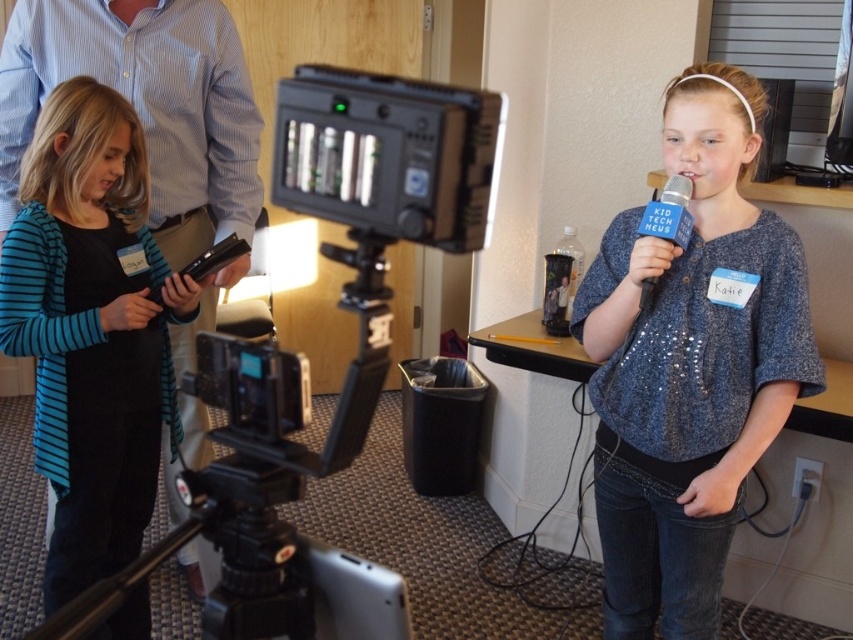
Question: Which of the following is the farthest from the observer?

Choices:
 (A) (358, 397)
 (B) (35, 168)
 (C) (677, 428)

Answer: (B)

Question: Which of the following is the farthest from the observer?

Choices:
 (A) (640, 308)
 (B) (392, 576)
 (C) (65, 278)

Answer: (C)

Question: From the image, what is the correct spatial relationship of blue striped cardigan at left in relation to blue fabric microphone at center?

Choices:
 (A) above
 (B) below

Answer: (B)

Question: Which object is closer to the camera taking this photo?

Choices:
 (A) sparkly blue blouse at center
 (B) blue striped cardigan at left
 (C) blue fabric microphone at center

Answer: (C)

Question: Does black plastic video camera at center appear under blue fabric microphone at center?

Choices:
 (A) yes
 (B) no

Answer: (A)

Question: Does black plastic video camera at center come behind blue fabric microphone at center?

Choices:
 (A) no
 (B) yes

Answer: (A)